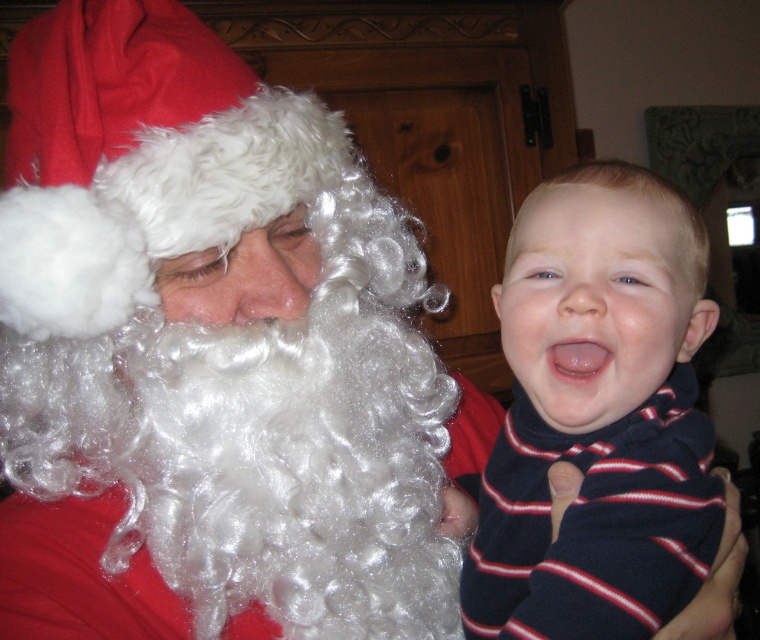
You are a photographer trying to capture a candid shot of the scene. You notice the white curly hair at left and the blue striped sweater at center. Which object is positioned lower in the frame?

The white curly hair at left is below the blue striped sweater at center, so it is positioned lower in the frame.

You are a photographer trying to capture a group photo of the white curly wig at upper left and the blue striped sweater at center. Based on their sizes, which object should you position closer to the camera to ensure both appear balanced in the frame?

The white curly wig at upper left is wider than the blue striped sweater at center. To balance their sizes in the photo, position the white curly wig at upper left slightly farther from the camera and bring the blue striped sweater at center closer. This way, their apparent sizes in the frame will be more balanced.

You are a photographer trying to capture the best angle of the Santa Claus figure and the child. Which object is covering the other one, the white curly wig at upper left or the white curly hair at left?

The white curly wig at upper left is positioned over white curly hair at left, so it is covering the white curly hair at left.